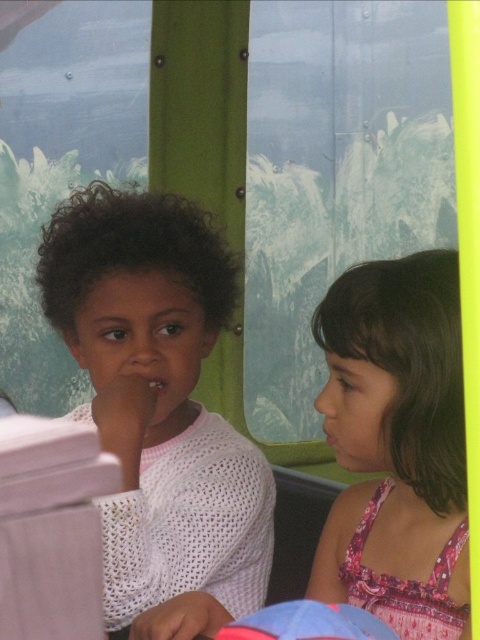
Question: Which point is closer to the camera?

Choices:
 (A) (145, 348)
 (B) (414, 358)

Answer: (B)

Question: Does white knitted sweater at center appear under pink floral dress at right?

Choices:
 (A) yes
 (B) no

Answer: (B)

Question: Which point is farther to the camera?

Choices:
 (A) (346, 547)
 (B) (130, 285)

Answer: (A)

Question: Among these points, which one is nearest to the camera?

Choices:
 (A) (107, 196)
 (B) (432, 352)

Answer: (B)

Question: Observing the image, what is the correct spatial positioning of white knitted sweater at center in reference to pink floral dress at right?

Choices:
 (A) below
 (B) above

Answer: (B)

Question: Is white knitted sweater at center thinner than pink floral dress at right?

Choices:
 (A) no
 (B) yes

Answer: (A)